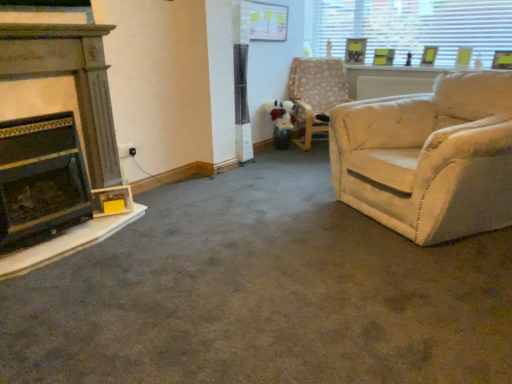
Question: Should I look upward or downward to see wooden fireplace at left, arranged as the second fireplace when ordered from the bottom?

Choices:
 (A) down
 (B) up

Answer: (B)

Question: Is black matte fireplace at left, the 1th fireplace when ordered from bottom to top, thinner than beige fabric chair at upper right?

Choices:
 (A) no
 (B) yes

Answer: (B)

Question: Considering the relative sizes of black matte fireplace at left, the 1th fireplace when ordered from bottom to top, and beige fabric chair at upper right in the image provided, is black matte fireplace at left, the 1th fireplace when ordered from bottom to top, wider than beige fabric chair at upper right?

Choices:
 (A) yes
 (B) no

Answer: (B)

Question: Is there a large distance between black matte fireplace at left, the 1th fireplace when ordered from bottom to top, and beige fabric chair at upper right?

Choices:
 (A) yes
 (B) no

Answer: (A)

Question: Is the position of black matte fireplace at left, positioned as the 2th fireplace in top-to-bottom order, more distant than that of beige fabric chair at upper right?

Choices:
 (A) no
 (B) yes

Answer: (A)

Question: Is black matte fireplace at left, positioned as the 2th fireplace in top-to-bottom order, facing towards beige fabric chair at upper right?

Choices:
 (A) no
 (B) yes

Answer: (A)

Question: Is beige fabric chair at upper right a part of black matte fireplace at left, positioned as the 2th fireplace in top-to-bottom order?

Choices:
 (A) yes
 (B) no

Answer: (B)

Question: Is wooden picture frame at upper right, arranged as the 1th picture frame when viewed from the left, further to camera compared to matte yellow picture frame at upper right, which appears as the first picture frame when viewed from the right?

Choices:
 (A) yes
 (B) no

Answer: (A)

Question: Is matte yellow picture frame at upper right, which appears as the first picture frame when viewed from the right, located within wooden picture frame at upper right, arranged as the 1th picture frame when viewed from the left?

Choices:
 (A) yes
 (B) no

Answer: (B)

Question: From a real-world perspective, is wooden picture frame at upper right, acting as the 3th picture frame starting from the right, on top of matte yellow picture frame at upper right, the 3th picture frame positioned from the left?

Choices:
 (A) yes
 (B) no

Answer: (A)

Question: Is wooden picture frame at upper right, arranged as the 1th picture frame when viewed from the left, oriented towards matte yellow picture frame at upper right, which appears as the first picture frame when viewed from the right?

Choices:
 (A) yes
 (B) no

Answer: (B)

Question: From the image's perspective, does wooden picture frame at upper right, arranged as the 1th picture frame when viewed from the left, appear higher than matte yellow picture frame at upper right, which appears as the first picture frame when viewed from the right?

Choices:
 (A) yes
 (B) no

Answer: (A)

Question: Is wooden picture frame at upper right, acting as the 3th picture frame starting from the right, wider than matte yellow picture frame at upper right, which appears as the first picture frame when viewed from the right?

Choices:
 (A) no
 (B) yes

Answer: (B)

Question: Is transparent glass window at upper right positioned behind matte yellow picture frame at upper right, which appears as the first picture frame when viewed from the right?

Choices:
 (A) no
 (B) yes

Answer: (A)